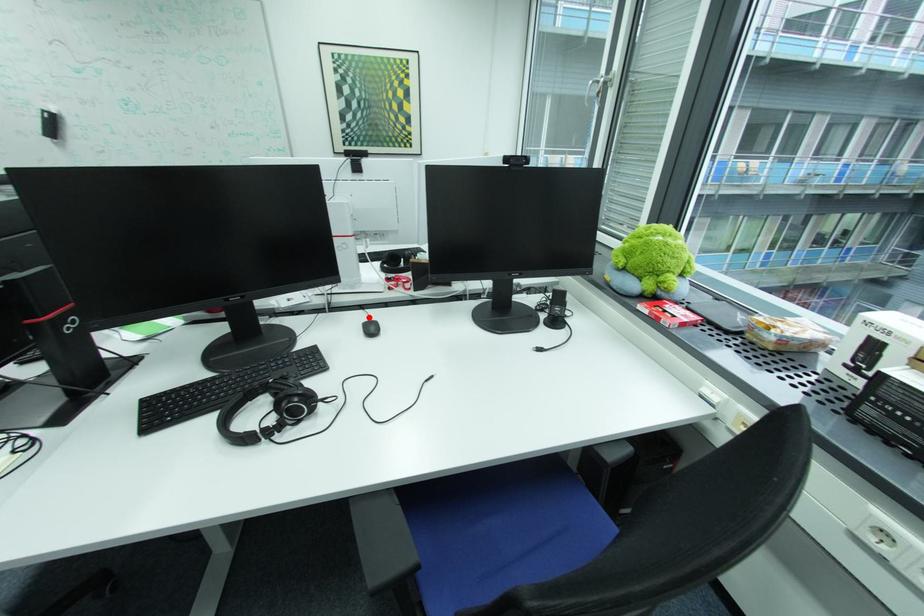
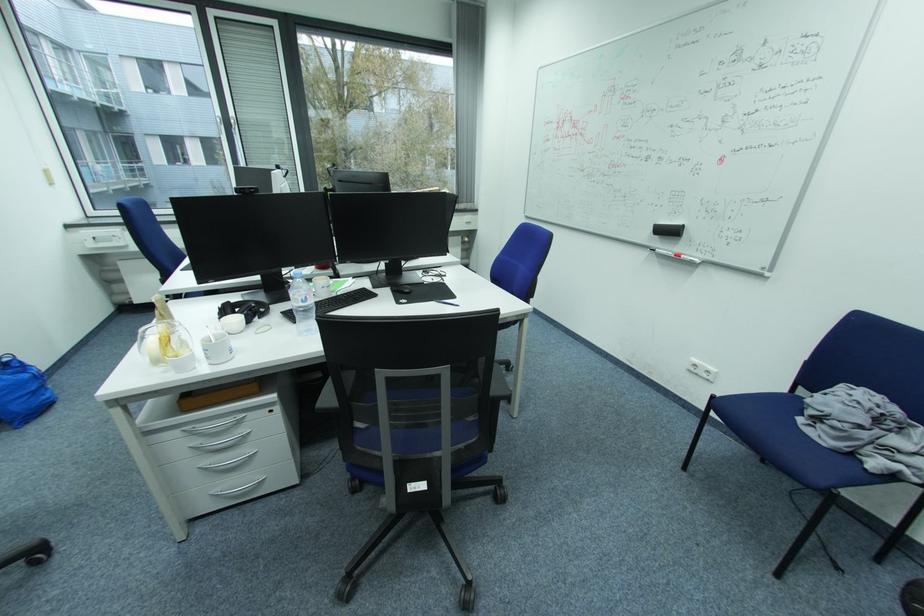
Question: I am providing you with two images of the same scene from different viewpoints. A red point is marked on the first image. Can you still see the location of the red point in image 2?

Choices:
 (A) Yes
 (B) No

Answer: (B)